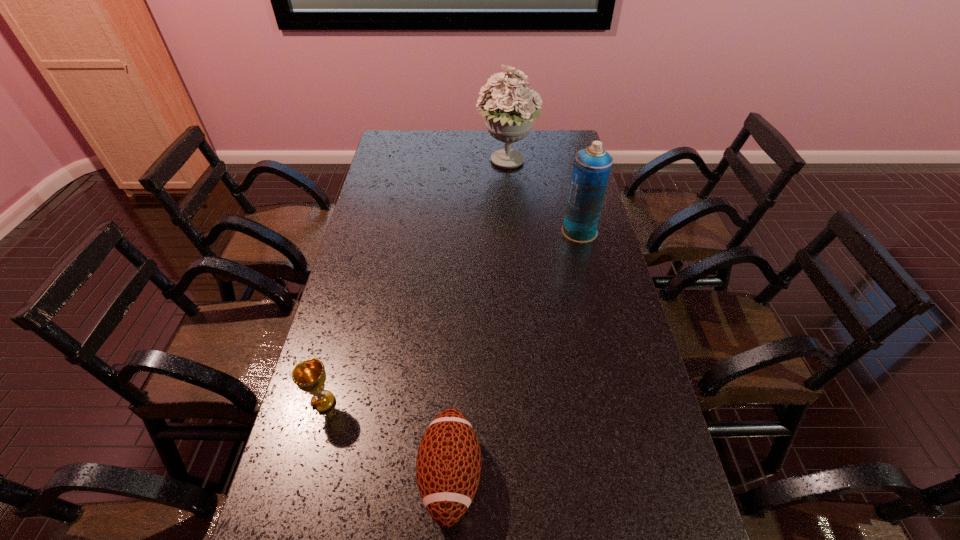
Image resolution: width=960 pixels, height=540 pixels. Identify the location of vacant area that satisfies the following two spatial constraints: 1. on the front side of the bouquet; 2. on the right side of the aerosol can. (512, 232).